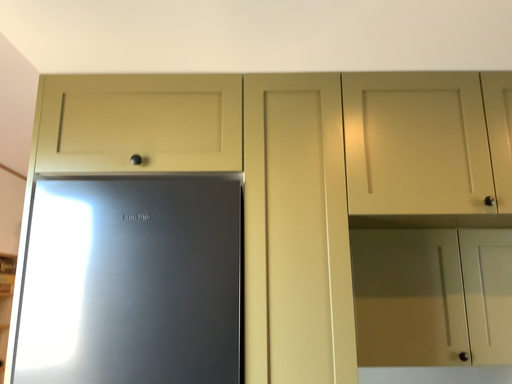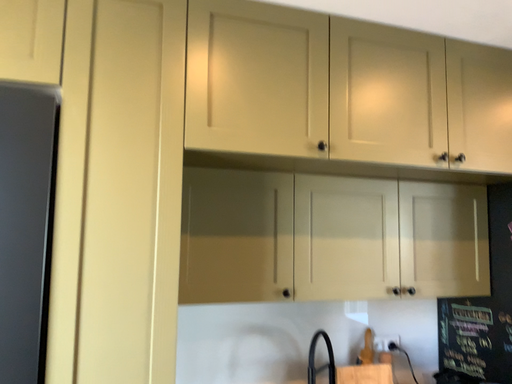
Question: Which way did the camera rotate in the video?

Choices:
 (A) rotated left
 (B) rotated right

Answer: (B)